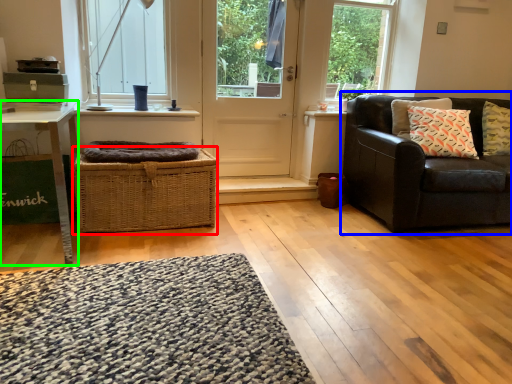
Question: Which object is positioned farthest from crate (highlighted by a red box)? Select from studio couch (highlighted by a blue box) and table (highlighted by a green box).

Choices:
 (A) studio couch
 (B) table

Answer: (A)